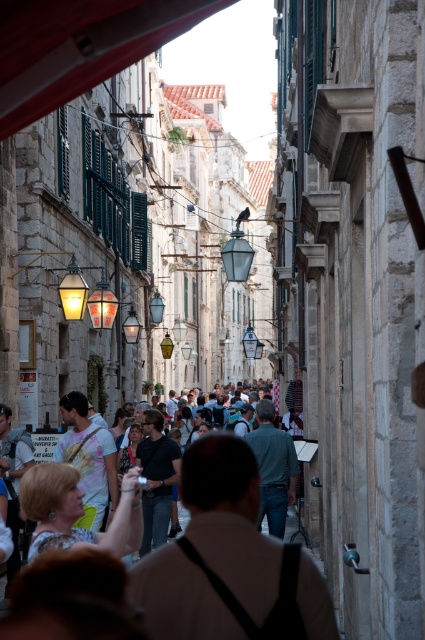
Is dark gray fabric at center further to camera compared to dark gray shirt at center?

That is False.

Does point (153, 564) come behind point (144, 452)?

No, it is in front of (144, 452).

Image resolution: width=425 pixels, height=640 pixels. What do you see at coordinates (231, 520) in the screenshot? I see `dark gray fabric at center` at bounding box center [231, 520].

I want to click on dark gray fabric at center, so pos(231,520).

Does dark gray fabric at center have a lesser width compared to light beige fabric purse at center?

Incorrect, dark gray fabric at center's width is not less than light beige fabric purse at center's.

Does dark gray fabric at center have a smaller size compared to light beige fabric purse at center?

Indeed, dark gray fabric at center has a smaller size compared to light beige fabric purse at center.

Where is `dark gray fabric at center`? The height and width of the screenshot is (640, 425). dark gray fabric at center is located at coordinates (231, 520).

Is light beige fabric purse at center shorter than dark gray shirt at center?

Yes.

Is point (31, 561) positioned after point (141, 548)?

No.

Find the location of a particular element. The width and height of the screenshot is (425, 640). light beige fabric purse at center is located at coordinates (76, 513).